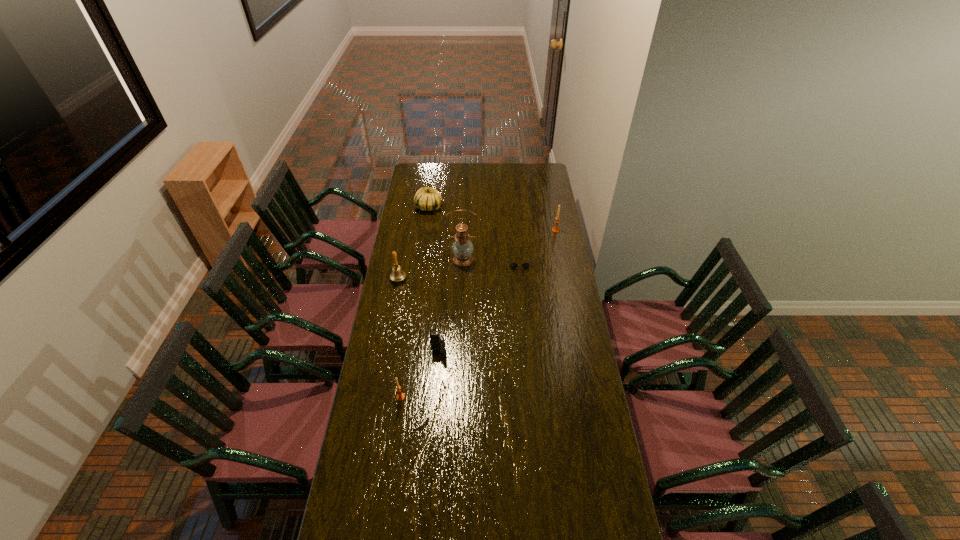
Locate an element on the screen. vacant area situated 0.390m on the right of the nearest object is located at coordinates (504, 397).

The width and height of the screenshot is (960, 540). I want to click on vacant space located 0.080m on the front of the sixth nearest object, so click(x=558, y=242).

This screenshot has width=960, height=540. In order to click on vacant space located on the left of the oil lamp in this screenshot , I will do `click(407, 260)`.

The height and width of the screenshot is (540, 960). Find the location of `vacant space situated on the front-facing side of the sunglasses`. vacant space situated on the front-facing side of the sunglasses is located at coordinates pos(525,326).

I want to click on vacant space situated on the back of the farthest object, so click(x=434, y=168).

Identify the location of vacant space located on the right of the bell. The width and height of the screenshot is (960, 540). (481, 279).

Identify the location of vacant space situated on the keyboard of the second nearest object. This screenshot has width=960, height=540. (436, 390).

Where is `candle_holder that is at the left edge`? The width and height of the screenshot is (960, 540). candle_holder that is at the left edge is located at coordinates (400, 396).

I want to click on gourd present at the left edge, so click(x=426, y=199).

You are a GUI agent. You are given a task and a screenshot of the screen. Output one action in this format:
    pyautogui.click(x=<x>, y=<y>)
    Task: Click on the bell at the left edge
    
    Given the screenshot: What is the action you would take?
    pyautogui.click(x=398, y=274)